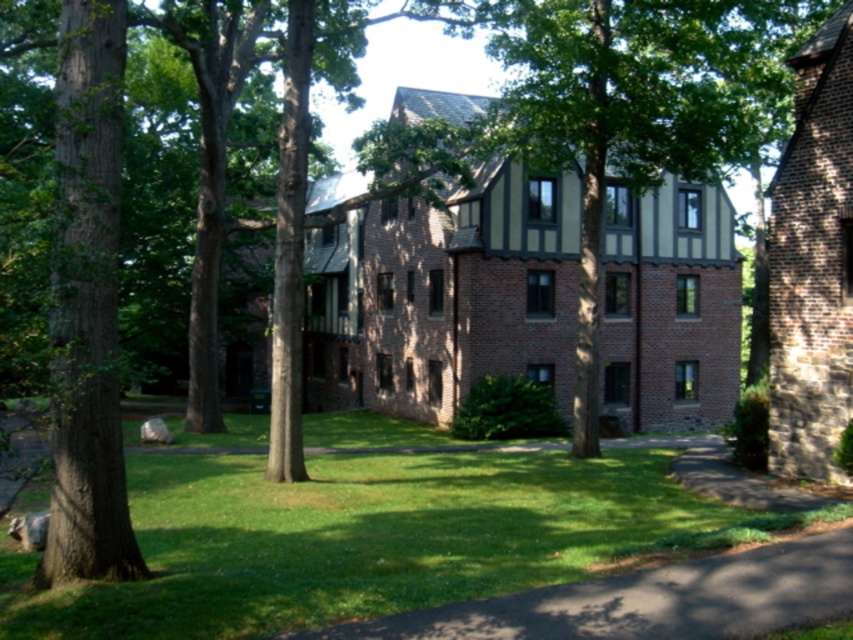
You are standing in front of the Tudor building and notice two points marked on the image. The first point is at coordinates point (312, 570) and the second is at point (679, 627). Which point is closer to your current position?

Point (312, 570) is closer to your current position because it is further to the camera than point (679, 627), meaning it appears nearer in the image.

You are planning to place a small garden statue in the area with the widest green grass. Which area should you choose between the green grass at center and the green grass at lower center?

The green grass at center is wider than the green grass at lower center, so you should choose the green grass at center for placing the small garden statue.